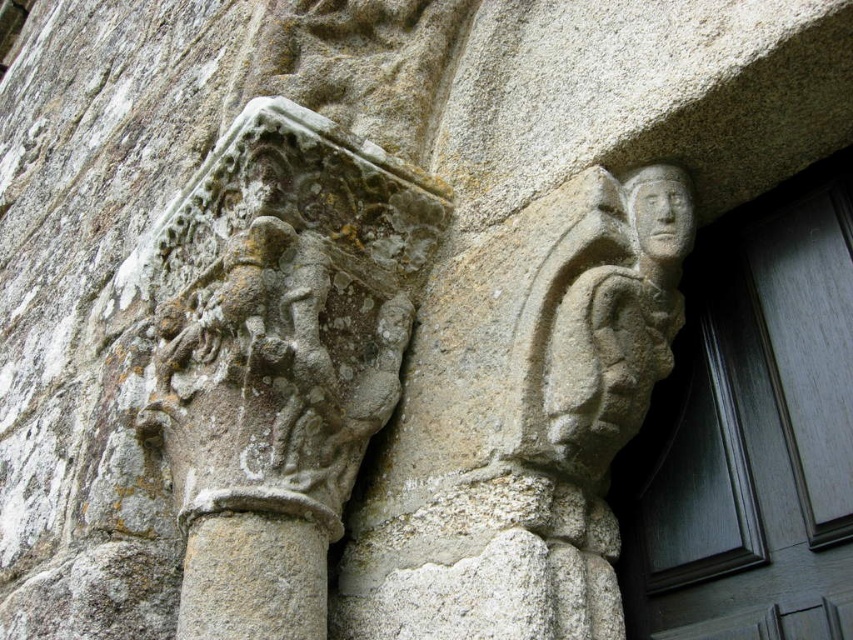
You are an architect analyzing the stone carving. The gray stone figure at upper right and another element are positioned in the image. Based on their coordinates, which object is closer to the center of the image?

The gray stone figure at upper right is located at point (520,420), so it is closer to the center of the image compared to other elements not specified here. However, since only its coordinates are provided, we can confirm its position relative to the center based on the given data.

In the scene shown: You are an architect examining the stone carvings. You notice the gray stone figure at upper right and the gray stone column at center. Which one is closer to you in this view?

The gray stone figure at upper right is closer to you because it is positioned in front of the gray stone column at center.

Based on the scene described, which object, the gray stone carving at upper left or the gray stone column at center, occupies a larger vertical space in the image?

The gray stone carving at upper left is much taller than the gray stone column at center, so it occupies a larger vertical space.